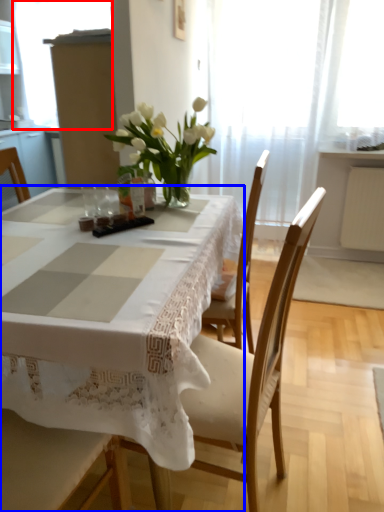
Question: Which object appears farthest to the camera in this image, window screen (highlighted by a red box) or table (highlighted by a blue box)?

Choices:
 (A) window screen
 (B) table

Answer: (A)